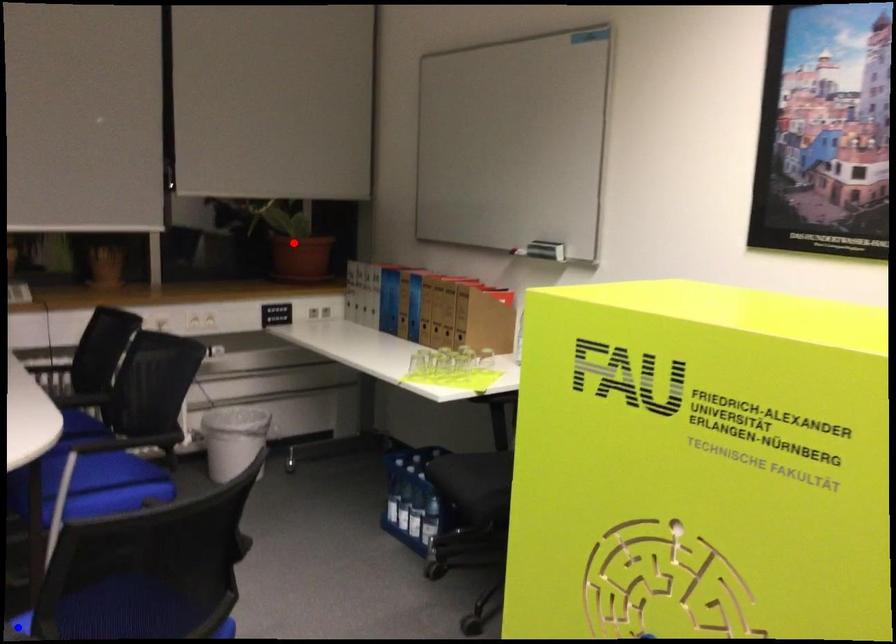
Question: In the image, two points are highlighted. Which point is nearer to the camera? Reply with the corresponding letter.

Choices:
 (A) blue point
 (B) red point

Answer: (A)